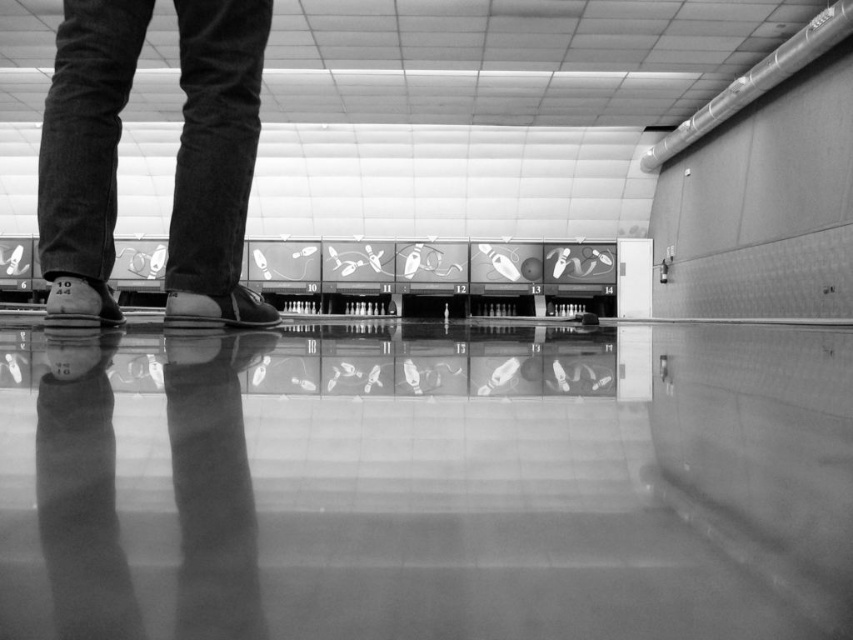
What do you see at coordinates (215, 161) in the screenshot?
I see `dark gray suede shoes at center` at bounding box center [215, 161].

Between dark gray suede shoes at center and leather at left, which one is positioned higher?

Positioned higher is dark gray suede shoes at center.

Which is behind, point (204, 32) or point (56, 320)?

The point (204, 32) is behind.

Where is `dark gray suede shoes at center`? dark gray suede shoes at center is located at coordinates (215, 161).

Where is `dark gray suede shoes at center`? This screenshot has height=640, width=853. dark gray suede shoes at center is located at coordinates (215, 161).

Is dark gray suede shoes at center thinner than leather shoe at center?

In fact, dark gray suede shoes at center might be wider than leather shoe at center.

Image resolution: width=853 pixels, height=640 pixels. What are the coordinates of `dark gray suede shoes at center` in the screenshot? It's located at (215, 161).

Measure the distance from leather shoe at center to leather at left.

leather shoe at center and leather at left are 8.62 inches apart.

Who is positioned more to the left, leather shoe at center or leather at left?

Positioned to the left is leather at left.

Does point (254, 320) come in front of point (97, 300)?

No, (254, 320) is further to viewer.

The height and width of the screenshot is (640, 853). In order to click on leather shoe at center in this screenshot , I will do coord(219,308).